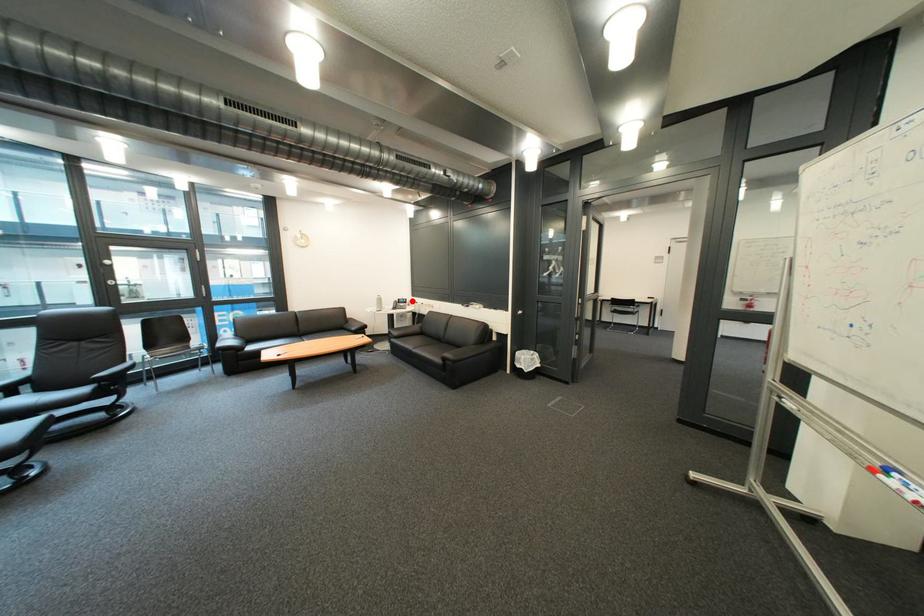
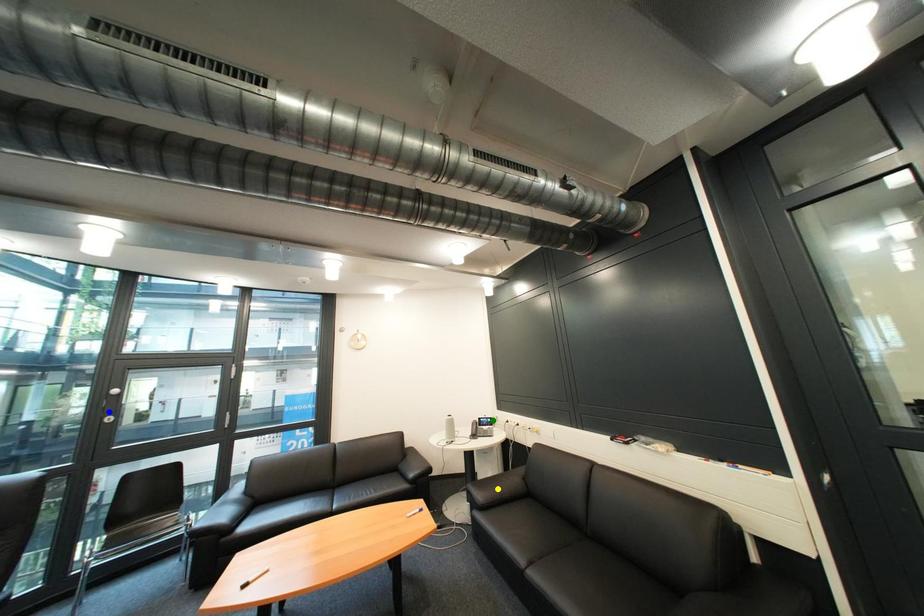
Question: I am providing you with two images of the same scene from different viewpoints. A red point is marked on the first image. You are given multiple points on the second image. Which point in image 2 represents the same 3d spot as the red point in image 1?

Choices:
 (A) green point
 (B) blue point
 (C) yellow point

Answer: (A)